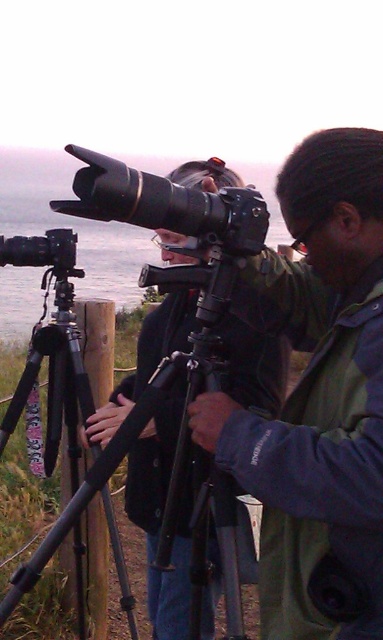
You are a photographer who needs to adjust the height of your equipment. You have a black matte tripod at left and a matte black camera at left. Which one should you adjust to achieve a higher position for your camera?

The black matte tripod at left has a greater height compared to the matte black camera at left, so adjusting the tripod would allow the camera to reach a higher position.

You are a photographer who wants to ensure your matte black camera at center is stable. Since the black matte tripod at left is taller than the camera, can you adjust the tripod legs to lower its height so the camera is at a comfortable eye level?

The matte black camera at center has a lesser height compared to the black matte tripod at left, so yes, you can lower the tripod legs to adjust the camera to a comfortable eye level.

You are a photographer who wants to choose a camera for capturing distant birds. You have two options in the scene, the matte black camera at center and the matte black camera at left. Which camera should you choose based on their sizes?

The matte black camera at center is bigger than the matte black camera at left, so you should choose the matte black camera at center for capturing distant birds because larger cameras often have better zoom capabilities and stability for telephoto lenses.